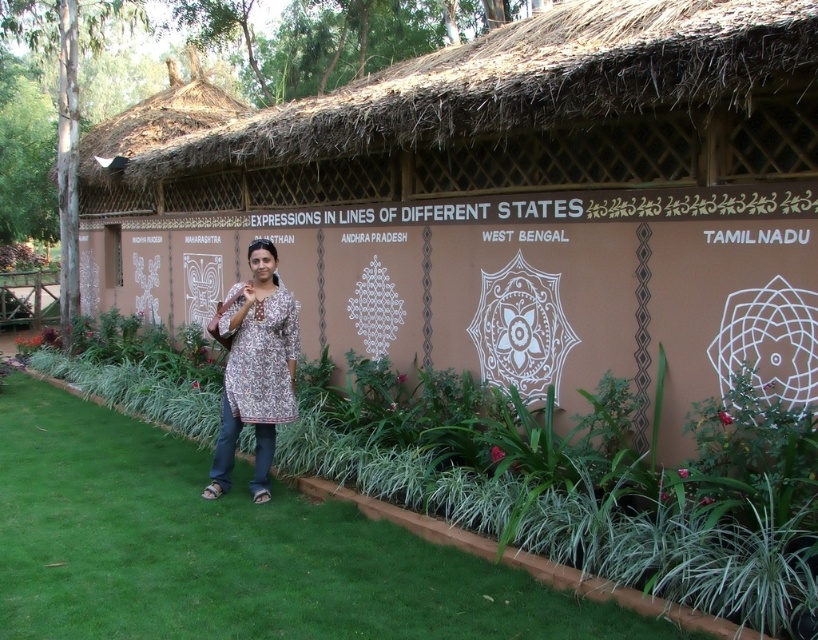
You are a photographer wanting to capture the brown thatched roof hut at center and the green grass at lower center in a single frame. Based on their positions, which object should you focus on first to ensure both are in the frame?

The brown thatched roof hut at center is above the green grass at lower center, so you should focus on the brown thatched roof hut at center first to ensure both are in the frame.

You are an architect designing a traditional Indian structure. You have to place a brown thatched roof hut at center and a printed cotton kurta at center in your design. Which object should you scale down to ensure they are proportionate?

The brown thatched roof hut at center is larger in size than the printed cotton kurta at center. To ensure proportionality, you should scale down the brown thatched roof hut at center so it matches the size of the printed cotton kurta at center.